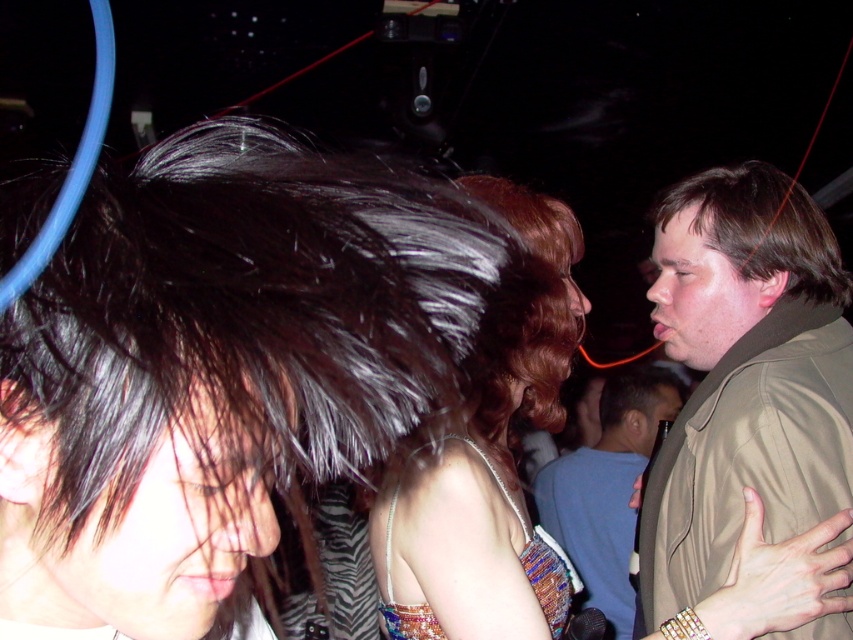
Is shiny black hair at center above khaki fabric jacket at right?

Yes.

Which is behind, point (325, 168) or point (824, 396)?

The point (824, 396) is more distant.

Is point (239, 237) positioned in front of point (726, 253)?

Yes, it is.

This screenshot has height=640, width=853. I want to click on shiny black hair at center, so click(x=218, y=365).

Does khaki fabric jacket at right appear on the left side of brown matte hair at right?

Correct, you'll find khaki fabric jacket at right to the left of brown matte hair at right.

Is point (846, 340) farther from viewer compared to point (787, 289)?

No, it is not.

Locate an element on the screen. This screenshot has width=853, height=640. khaki fabric jacket at right is located at coordinates (744, 376).

Can you confirm if khaki fabric jacket at right is taller than light blue shirt at center?

Yes, khaki fabric jacket at right is taller than light blue shirt at center.

The image size is (853, 640). What are the coordinates of `khaki fabric jacket at right` in the screenshot? It's located at (744, 376).

Locate an element on the screen. khaki fabric jacket at right is located at coordinates (744, 376).